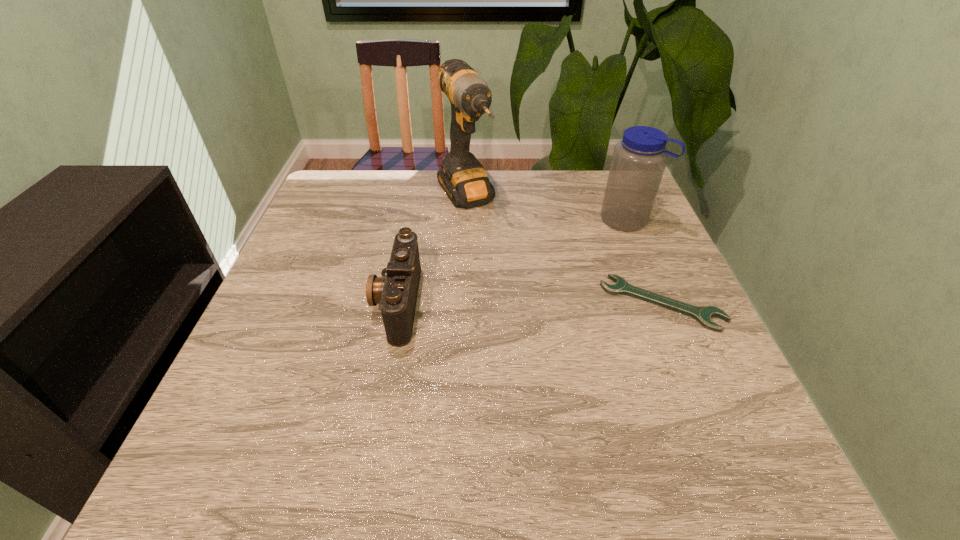
Locate an element on the screen. The width and height of the screenshot is (960, 540). the leftmost object is located at coordinates (396, 291).

At what (x,y) coordinates should I click in order to perform the action: click on the third tallest object. Please return your answer as a coordinate pair (x, y). This screenshot has height=540, width=960. Looking at the image, I should click on (396, 291).

What are the coordinates of `wrench` in the screenshot? It's located at (703, 315).

Where is `the second tallest object`? The width and height of the screenshot is (960, 540). the second tallest object is located at coordinates (639, 160).

You are a GUI agent. You are given a task and a screenshot of the screen. Output one action in this format:
    pyautogui.click(x=<x>, y=<y>)
    Task: Click on the second object from left to right
    Image resolution: width=960 pixels, height=540 pixels.
    Given the screenshot: What is the action you would take?
    pyautogui.click(x=463, y=178)

Identify the location of drill. The height and width of the screenshot is (540, 960). (463, 178).

I want to click on vacant space located on the front-facing side of the leftmost object, so click(342, 302).

I want to click on free space located 0.240m on the front-facing side of the leftmost object, so click(x=263, y=302).

I want to click on vacant region located 0.240m on the front-facing side of the leftmost object, so click(x=263, y=302).

Find the location of `vacant space located 0.390m on the left of the wrench`. vacant space located 0.390m on the left of the wrench is located at coordinates (423, 303).